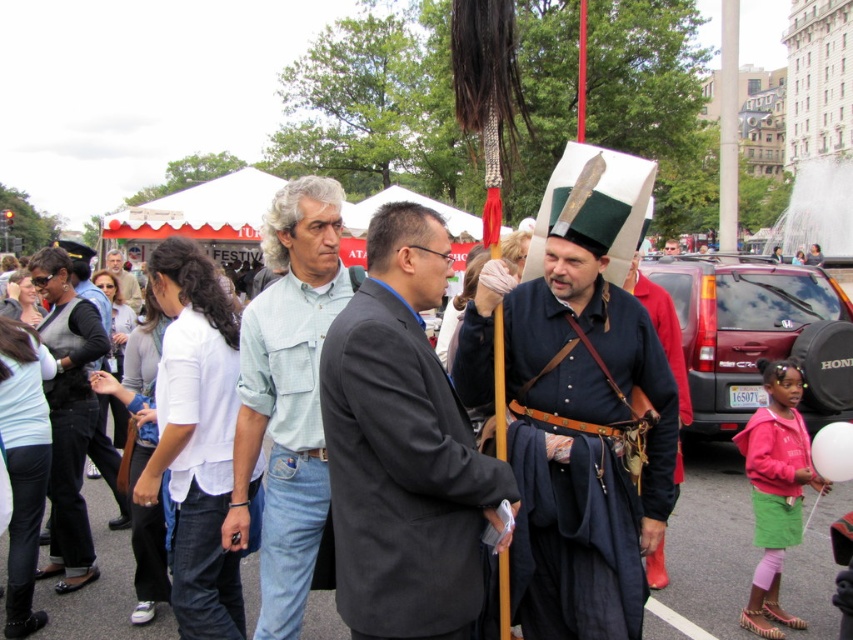
Consider the image. You are a photographer trying to capture a photo of the white cotton shirt at center and the black leather jacket at center. Which one is located to the right of the other?

The white cotton shirt at center is positioned on the right side of black leather jacket at center.

You are a photographer trying to capture a clear photo of the white cotton shirt at center and the black leather jacket at center. Which one will be more visible in your photo?

The white cotton shirt at center will be more visible in the photo because it is in front of the black leather jacket at center, making it appear closer to the camera and thus more prominent in the frame.